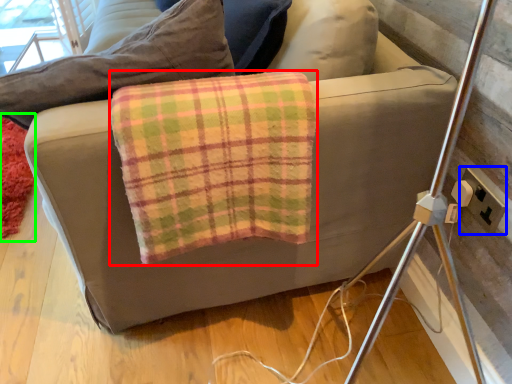
Question: Considering the real-world distances, which object is closest to material (highlighted by a red box)? electric outlet (highlighted by a blue box) or mat (highlighted by a green box).

Choices:
 (A) electric outlet
 (B) mat

Answer: (A)